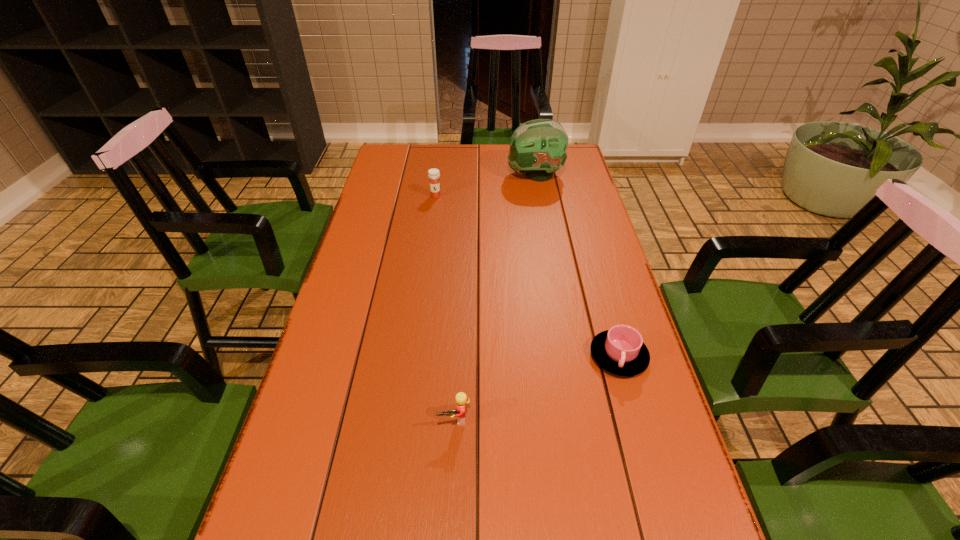
Find the location of a particular element. The width and height of the screenshot is (960, 540). free location located 0.220m on the visor of the farthest object is located at coordinates (449, 175).

At what (x,y) coordinates should I click in order to perform the action: click on vacant space located 0.140m on the label side of the medicine. Please return your answer as a coordinate pair (x, y). Looking at the image, I should click on (x=432, y=222).

In order to click on vacant region located in front of the nearest object with the accessory visible in this screenshot , I will do `click(449, 518)`.

Where is `free spot located 0.200m on the side with the handle of the shortest object`? This screenshot has height=540, width=960. free spot located 0.200m on the side with the handle of the shortest object is located at coordinates (650, 467).

You are a GUI agent. You are given a task and a screenshot of the screen. Output one action in this format:
    pyautogui.click(x=<x>, y=<y>)
    Task: Click on the object located at the far edge
    
    Given the screenshot: What is the action you would take?
    pyautogui.click(x=538, y=147)

This screenshot has width=960, height=540. In order to click on football helmet at the right edge in this screenshot , I will do `click(538, 147)`.

Locate an element on the screen. cup that is at the right edge is located at coordinates pyautogui.click(x=620, y=350).

Locate an element on the screen. The height and width of the screenshot is (540, 960). object present at the far right corner is located at coordinates (538, 147).

At what (x,y) coordinates should I click in order to perform the action: click on free space at the far edge of the desktop. Please return your answer as a coordinate pair (x, y). The height and width of the screenshot is (540, 960). Looking at the image, I should click on (505, 153).

Image resolution: width=960 pixels, height=540 pixels. In the image, there is a desktop. In order to click on vacant region at the left edge in this screenshot , I will do `click(376, 207)`.